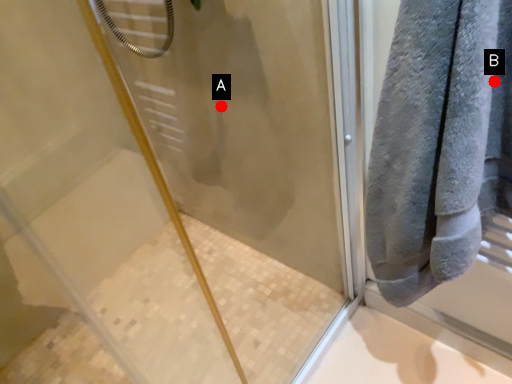
Question: Two points are circled on the image, labeled by A and B beside each circle. Which point is farther from the camera taking this photo?

Choices:
 (A) A is further
 (B) B is further

Answer: (A)